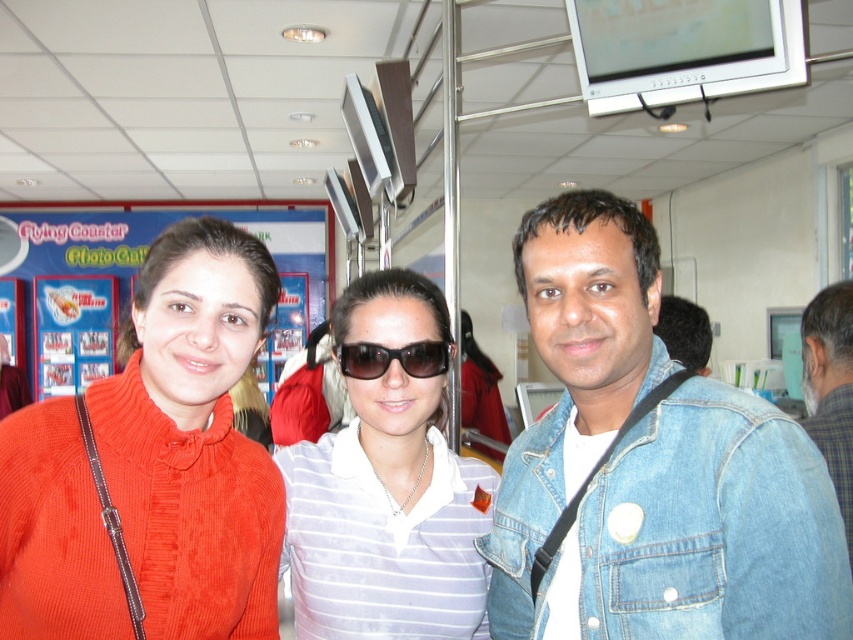
You are at an event and want to take a photo of the sunglasses at center without the denim jacket at lower right appearing in the frame. How should you adjust your camera angle?

To avoid including the denim jacket at lower right in the frame, you should angle your camera upward so that the sunglasses at center remain visible while the denim jacket at lower right, which is positioned below the sunglasses, is excluded from the shot.

You are a photographer at the event and need to ensure that the denim jacket at lower right and the sunglasses at center are both visible in a closeup shot. Given their sizes, which object should you focus on to ensure both are in frame without cropping?

The denim jacket at lower right is bigger than the sunglasses at center, so you should focus on the denim jacket at lower right since it requires more space to be fully visible, ensuring the smaller sunglasses at center will also fit in the frame.